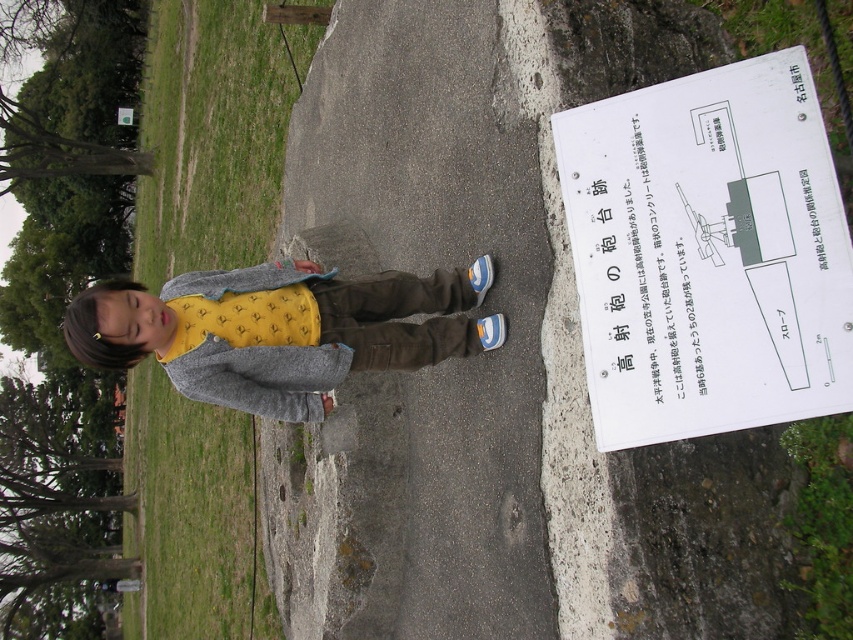
Question: Does white paper sign at right have a greater width compared to yellow cotton shirt at center?

Choices:
 (A) no
 (B) yes

Answer: (B)

Question: Which object appears farthest from the camera in this image?

Choices:
 (A) gray concrete pavement at center
 (B) yellow cotton shirt at center
 (C) white paper sign at right

Answer: (B)

Question: Can you confirm if gray concrete pavement at center is smaller than green grass at lower left?

Choices:
 (A) yes
 (B) no

Answer: (A)

Question: Among these points, which one is farthest from the camera?

Choices:
 (A) (488, 296)
 (B) (283, 269)

Answer: (A)

Question: Can you confirm if gray concrete pavement at center is wider than yellow cotton shirt at center?

Choices:
 (A) no
 (B) yes

Answer: (B)

Question: Which object is the farthest from the white paper sign at right?

Choices:
 (A) yellow cotton shirt at center
 (B) green grass at lower left

Answer: (B)